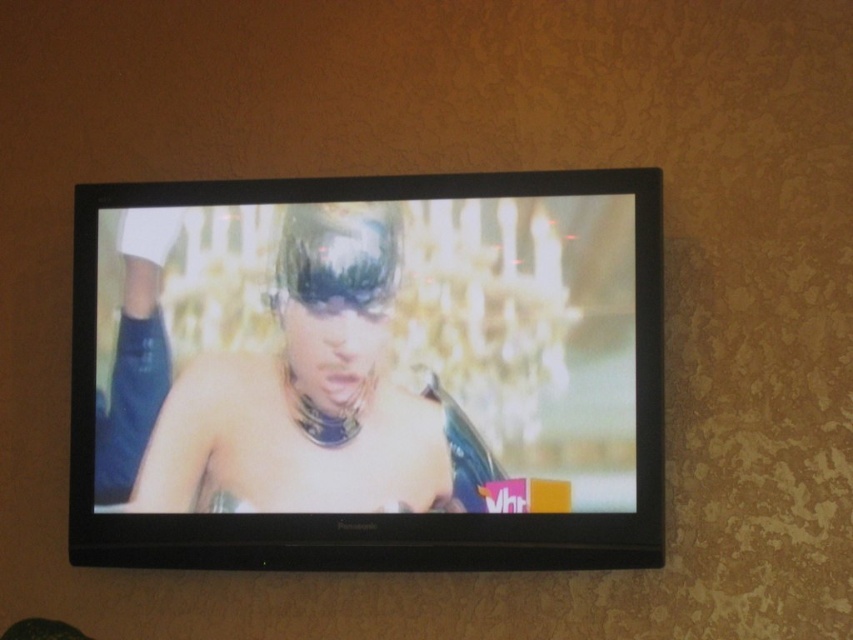
Between black glossy tv at center and shiny black hair at center, which one appears on the right side from the viewer's perspective?

black glossy tv at center is more to the right.

Who is more distant from viewer, (604, 538) or (422, 481)?

The point (422, 481) is behind.

The width and height of the screenshot is (853, 640). I want to click on black glossy tv at center, so click(369, 372).